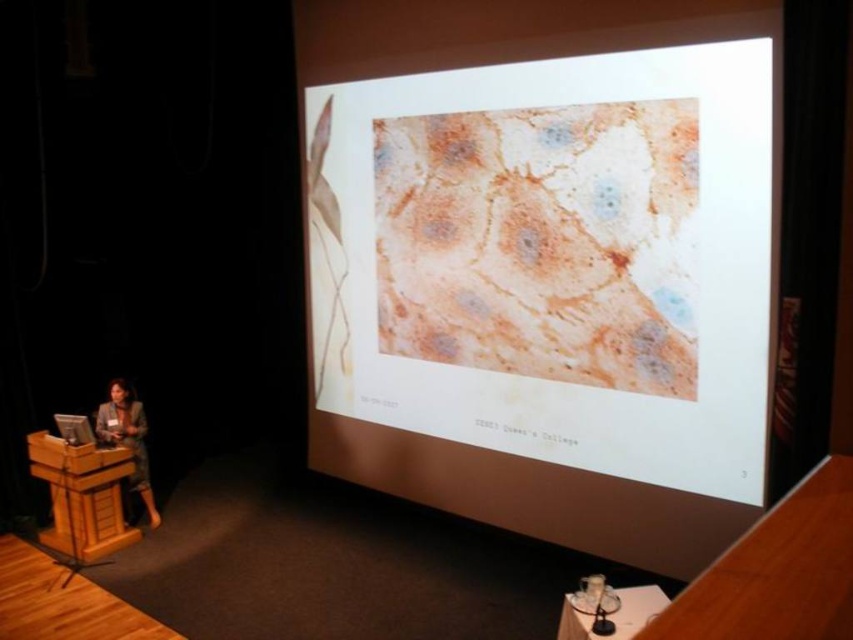
Question: Is wooden podium at lower left positioned at the back of matte black suit at lower left?

Choices:
 (A) yes
 (B) no

Answer: (B)

Question: Which is farther from the wooden podium at lower left?

Choices:
 (A) matte paper slide at center
 (B) matte black suit at lower left

Answer: (A)

Question: Estimate the real-world distances between objects in this image. Which object is farther from the matte black suit at lower left?

Choices:
 (A) matte paper slide at center
 (B) wooden podium at lower left

Answer: (A)

Question: Considering the real-world distances, which object is closest to the matte paper slide at center?

Choices:
 (A) matte black suit at lower left
 (B) wooden podium at lower left

Answer: (B)

Question: Can you confirm if matte paper slide at center is smaller than matte black suit at lower left?

Choices:
 (A) yes
 (B) no

Answer: (B)

Question: Is matte paper slide at center further to camera compared to matte black suit at lower left?

Choices:
 (A) yes
 (B) no

Answer: (B)